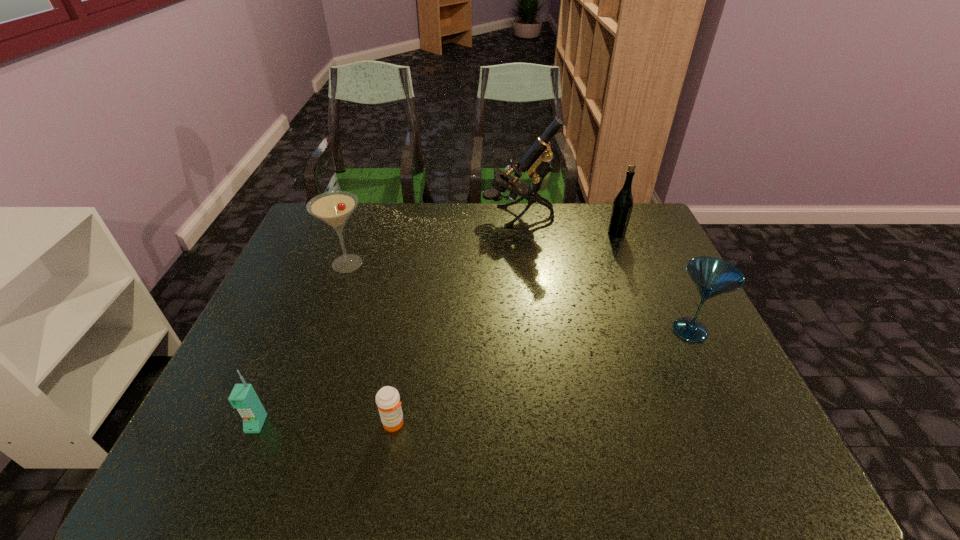
Image resolution: width=960 pixels, height=540 pixels. What are the coordinates of `microscope` in the screenshot? It's located at (536, 161).

Where is `the tallest object`? the tallest object is located at coordinates (536, 161).

In order to click on beer bottle in this screenshot , I will do `click(622, 207)`.

Identify the location of the farther martini. This screenshot has width=960, height=540. (334, 208).

Locate an element on the screen. the third farthest object is located at coordinates (334, 208).

Locate an element on the screen. the right martini is located at coordinates (711, 276).

Where is `the nearer martini`? the nearer martini is located at coordinates (711, 276).

At what (x,y) coordinates should I click in order to perform the action: click on the second shortest object. Please return your answer as a coordinate pair (x, y). Looking at the image, I should click on (243, 397).

This screenshot has width=960, height=540. In order to click on the third object from left to right in this screenshot , I will do `click(387, 398)`.

You are a GUI agent. You are given a task and a screenshot of the screen. Output one action in this format:
    pyautogui.click(x=<x>, y=<y>)
    Task: Click on the medicine
    
    Given the screenshot: What is the action you would take?
    pyautogui.click(x=387, y=398)